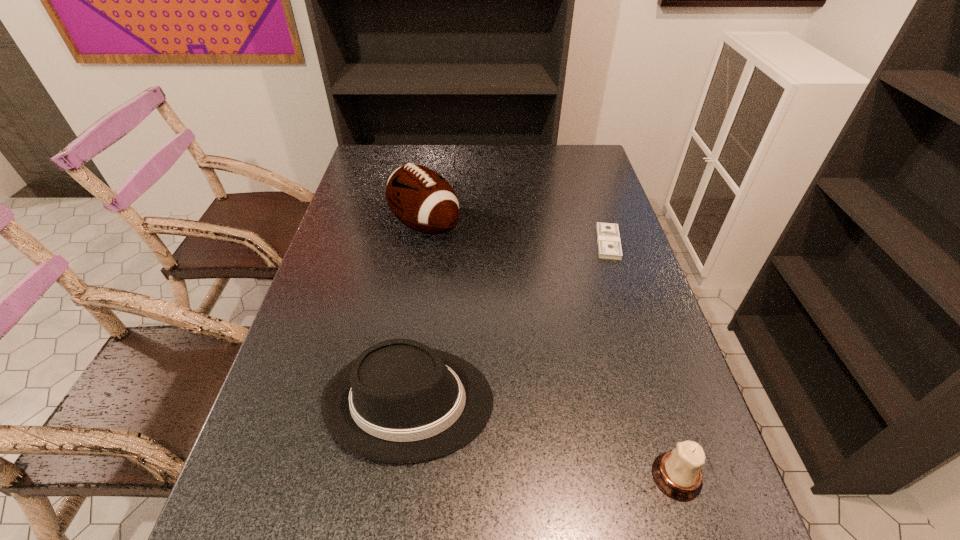
Image resolution: width=960 pixels, height=540 pixels. In order to click on candle holder present at the right edge in this screenshot , I will do `click(678, 474)`.

I want to click on dollar that is positioned at the right edge, so click(x=609, y=245).

In the image, there is a desktop. Find the location of `vacant space at the far edge`. vacant space at the far edge is located at coordinates (517, 173).

Where is `vacant space at the left edge of the desktop`? The image size is (960, 540). vacant space at the left edge of the desktop is located at coordinates (x=352, y=269).

You are a GUI agent. You are given a task and a screenshot of the screen. Output one action in this format:
    pyautogui.click(x=<x>, y=<y>)
    Task: Click on the free spot at the right edge of the desktop
    
    Given the screenshot: What is the action you would take?
    pyautogui.click(x=602, y=208)

At what (x,y) coordinates should I click in order to perform the action: click on vacant region at the far right corner of the desktop. Please return your answer as a coordinate pair (x, y). Looking at the image, I should click on point(565,149).

At what (x,y) coordinates should I click in order to perform the action: click on vacant area between the second shortest object and the shortest object. Please return your answer as a coordinate pair (x, y). Looking at the image, I should click on (642, 359).

At what (x,y) coordinates should I click in order to perform the action: click on vacant space in between the football (American) and the shortest object. Please return your answer as a coordinate pair (x, y). The height and width of the screenshot is (540, 960). Looking at the image, I should click on (516, 234).

This screenshot has width=960, height=540. I want to click on vacant area between the second shortest object and the dollar, so click(x=642, y=359).

The image size is (960, 540). Find the location of `free space between the candle holder and the tallest object`. free space between the candle holder and the tallest object is located at coordinates (551, 351).